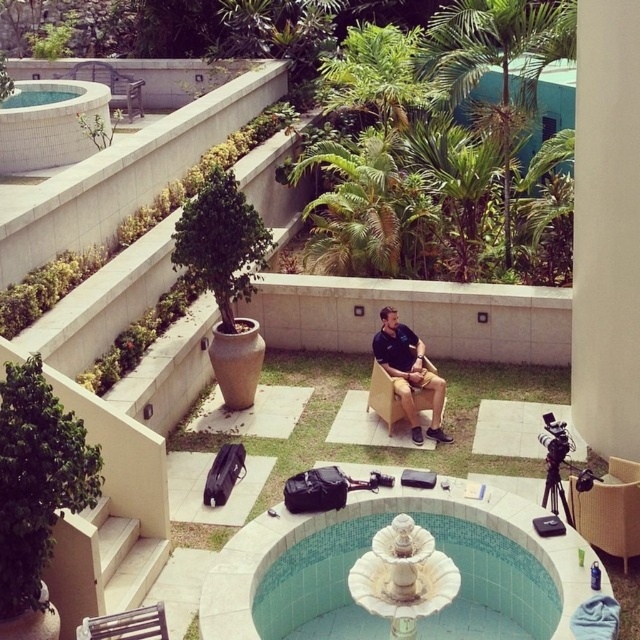
You are planning to place a new plant pot between the white ceramic jacuzzi at upper left and the metallic silver chair at lower left. Based on their positions, which object should the plant pot be closer to?

The white ceramic jacuzzi at upper left is positioned over the metallic silver chair at lower left, so the plant pot should be placed closer to the white ceramic jacuzzi at upper left.

You are planning to install a new lighting system for the white ceramic fountain at center and the white ceramic jacuzzi at upper left. The lights you have are designed to be placed on top of structures. Which structure will require taller lights to accommodate the installation?

The white ceramic jacuzzi at upper left requires taller lights because it is taller than the white ceramic fountain at center.